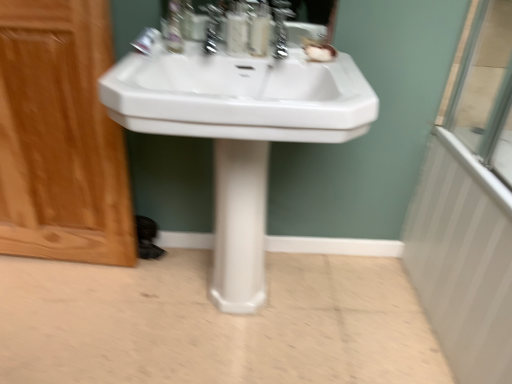
Where is `white glossy pedestal at center`? white glossy pedestal at center is located at coordinates (239, 225).

Where is `polished chrome faucet at upper center, marked as the 1th faucet in a left-to-right arrangement`? This screenshot has width=512, height=384. polished chrome faucet at upper center, marked as the 1th faucet in a left-to-right arrangement is located at coordinates (213, 25).

Identify the location of translucent plastic soap dispenser at upper center, the second soap dispenser viewed from the left. (259, 29).

What's the angular difference between translucent plastic soap dispenser at upper center, the second soap dispenser viewed from the left, and white glossy pedestal at center's facing directions?

The facing directions of translucent plastic soap dispenser at upper center, the second soap dispenser viewed from the left, and white glossy pedestal at center are 4.74 degrees apart.

Considering the relative sizes of translucent plastic soap dispenser at upper center, positioned as the first soap dispenser in right-to-left order, and white glossy pedestal at center in the image provided, is translucent plastic soap dispenser at upper center, positioned as the first soap dispenser in right-to-left order, thinner than white glossy pedestal at center?

Yes, translucent plastic soap dispenser at upper center, positioned as the first soap dispenser in right-to-left order, is thinner than white glossy pedestal at center.

From the image's perspective, who appears lower, translucent plastic soap dispenser at upper center, positioned as the first soap dispenser in right-to-left order, or white glossy pedestal at center?

white glossy pedestal at center is shown below in the image.

Do you think translucent plastic soap dispenser at upper center, the second soap dispenser viewed from the left, is within white glossy pedestal at center, or outside of it?

translucent plastic soap dispenser at upper center, the second soap dispenser viewed from the left, is not inside white glossy pedestal at center, it's outside.

Is white glossy pedestal at center completely or partially outside of white textured radiator at right?

That's correct, white glossy pedestal at center is outside of white textured radiator at right.

Does white glossy pedestal at center appear on the left side of white textured radiator at right?

Yes.

Considering the relative sizes of white glossy pedestal at center and white textured radiator at right in the image provided, is white glossy pedestal at center bigger than white textured radiator at right?

Yes, white glossy pedestal at center is bigger than white textured radiator at right.

How much distance is there between white glossy pedestal at center and white textured radiator at right?

white glossy pedestal at center and white textured radiator at right are 24.82 inches apart.

Is point (82, 122) positioned behind point (173, 34)?

Yes, point (82, 122) is behind point (173, 34).

Would you say wooden screen door at left is inside or outside clear plastic bottle at upper center?

wooden screen door at left cannot be found inside clear plastic bottle at upper center.

From the picture: Can you tell me how much wooden screen door at left and clear plastic bottle at upper center differ in facing direction?

They differ by 9.39 degrees in their facing directions.

Does wooden screen door at left come in front of clear plastic bottle at upper center?

Yes, wooden screen door at left is closer to the viewer.

From a real-world perspective, who is located higher, wooden screen door at left or satin nickel faucet at upper center, which is the first faucet in right-to-left order?

satin nickel faucet at upper center, which is the first faucet in right-to-left order, from a real-world perspective.

Are wooden screen door at left and satin nickel faucet at upper center, which is the 2th faucet in left-to-right order, making contact?

They are not placed beside each other.

From the image's perspective, which object appears higher, wooden screen door at left or satin nickel faucet at upper center, which is the 2th faucet in left-to-right order?

satin nickel faucet at upper center, which is the 2th faucet in left-to-right order, is shown above in the image.

Is wooden screen door at left bigger or smaller than satin nickel faucet at upper center, which is the 2th faucet in left-to-right order?

Clearly, wooden screen door at left is larger in size than satin nickel faucet at upper center, which is the 2th faucet in left-to-right order.

Does satin nickel faucet at upper center, which is the 2th faucet in left-to-right order, come in front of white textured radiator at right?

No, satin nickel faucet at upper center, which is the 2th faucet in left-to-right order, is further to the viewer.

From the picture: From the image's perspective, which one is positioned lower, satin nickel faucet at upper center, which is the 2th faucet in left-to-right order, or white textured radiator at right?

white textured radiator at right appears lower in the image.

Is white textured radiator at right facing away from clear plastic bottle at upper center?

That's not correct — white textured radiator at right is not looking away from clear plastic bottle at upper center.

Considering the sizes of objects white textured radiator at right and clear plastic bottle at upper center in the image provided, who is thinner, white textured radiator at right or clear plastic bottle at upper center?

white textured radiator at right is thinner.

Is white textured radiator at right far from clear plastic bottle at upper center?

Absolutely, white textured radiator at right is distant from clear plastic bottle at upper center.

Is satin nickel faucet at upper center, which is the first faucet in right-to-left order, bigger than white glossy sink at center?

No.

Is satin nickel faucet at upper center, which is the first faucet in right-to-left order, facing away from white glossy sink at center?

That's not correct — satin nickel faucet at upper center, which is the first faucet in right-to-left order, is not looking away from white glossy sink at center.

Looking at this image, which is closer, (x=280, y=23) or (x=234, y=86)?

Point (x=280, y=23).

Can you confirm if satin nickel faucet at upper center, which is the first faucet in right-to-left order, is shorter than white glossy sink at center?

Indeed, satin nickel faucet at upper center, which is the first faucet in right-to-left order, has a lesser height compared to white glossy sink at center.

The image size is (512, 384). Identify the location of bidet in front of the translucent plastic soap dispenser at upper center, the second soap dispenser viewed from the left. (239, 225).

Identify the location of bidet below the white textured radiator at right (from a real-world perspective). (239, 225).

Estimate the real-world distances between objects in this image. Which object is further from white glossy sink at center, wooden screen door at left or polished chrome faucet at upper center, which is the second faucet in right-to-left order?

wooden screen door at left.

When comparing their distances from translucent plastic soap dispenser at upper center, positioned as the first soap dispenser in right-to-left order, does white textured radiator at right or translucent plastic soap dispenser at center, positioned as the second soap dispenser in right-to-left order, seem further?

Among the two, white textured radiator at right is located further to translucent plastic soap dispenser at upper center, positioned as the first soap dispenser in right-to-left order.

When comparing their distances from translucent plastic soap dispenser at center, positioned as the second soap dispenser in right-to-left order, does translucent plastic soap dispenser at upper center, the second soap dispenser viewed from the left, or white glossy sink at center seem further?

Based on the image, white glossy sink at center appears to be further to translucent plastic soap dispenser at center, positioned as the second soap dispenser in right-to-left order.

Looking at the image, which one is located closer to satin nickel faucet at upper center, which is the first faucet in right-to-left order, polished chrome faucet at upper center, marked as the 1th faucet in a left-to-right arrangement, or white textured radiator at right?

Based on the image, polished chrome faucet at upper center, marked as the 1th faucet in a left-to-right arrangement, appears to be nearer to satin nickel faucet at upper center, which is the first faucet in right-to-left order.

Looking at this image, when comparing their distances from satin nickel faucet at upper center, which is the first faucet in right-to-left order, does translucent plastic soap dispenser at center, positioned as the second soap dispenser in right-to-left order, or white textured radiator at right seem further?

Among the two, white textured radiator at right is located further to satin nickel faucet at upper center, which is the first faucet in right-to-left order.

Estimate the real-world distances between objects in this image. Which object is further from wooden screen door at left, white textured radiator at right or white glossy pedestal at center?

white textured radiator at right is positioned further to the anchor wooden screen door at left.

Looking at the image, which one is located closer to polished chrome faucet at upper center, which is the second faucet in right-to-left order, white glossy sink at center or satin nickel faucet at upper center, which is the first faucet in right-to-left order?

satin nickel faucet at upper center, which is the first faucet in right-to-left order, is closer to polished chrome faucet at upper center, which is the second faucet in right-to-left order.

Considering their positions, is wooden screen door at left positioned further to clear plastic bottle at upper center than white glossy pedestal at center?

The object further to clear plastic bottle at upper center is white glossy pedestal at center.

The image size is (512, 384). Find the location of `soap dispenser between wooden screen door at left and white glossy sink at center in the horizontal direction`. soap dispenser between wooden screen door at left and white glossy sink at center in the horizontal direction is located at coordinates (237, 29).

This screenshot has width=512, height=384. I want to click on bidet between polished chrome faucet at upper center, which is the second faucet in right-to-left order, and white textured radiator at right, so click(x=239, y=225).

At what (x,y) coordinates should I click in order to perform the action: click on sink situated between clear plastic bottle at upper center and satin nickel faucet at upper center, which is the 2th faucet in left-to-right order, from left to right. Please return your answer as a coordinate pair (x, y). This screenshot has width=512, height=384. Looking at the image, I should click on (239, 97).

This screenshot has height=384, width=512. I want to click on mouthwash between wooden screen door at left and polished chrome faucet at upper center, which is the second faucet in right-to-left order, so click(174, 27).